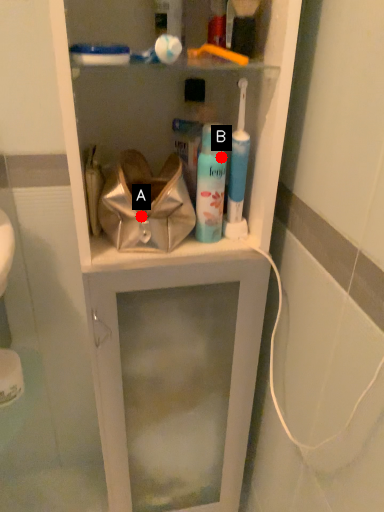
Question: Two points are circled on the image, labeled by A and B beside each circle. Which point is farther from the camera taking this photo?

Choices:
 (A) A is further
 (B) B is further

Answer: (A)